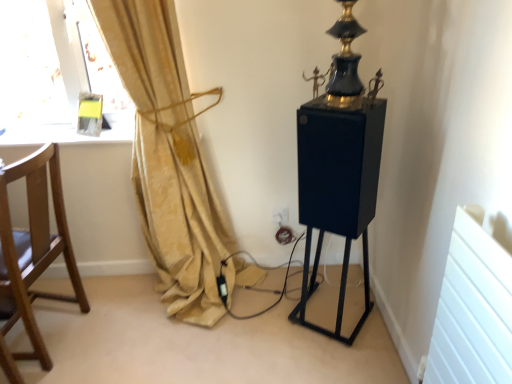
Question: Does gold fabric curtain at left turn towards matte glass window sill at upper left?

Choices:
 (A) no
 (B) yes

Answer: (A)

Question: From a real-world perspective, is gold fabric curtain at left located higher than matte glass window sill at upper left?

Choices:
 (A) yes
 (B) no

Answer: (B)

Question: Is gold fabric curtain at left looking in the opposite direction of matte glass window sill at upper left?

Choices:
 (A) yes
 (B) no

Answer: (A)

Question: Does gold fabric curtain at left appear on the left side of matte glass window sill at upper left?

Choices:
 (A) no
 (B) yes

Answer: (A)

Question: Is gold fabric curtain at left smaller than matte glass window sill at upper left?

Choices:
 (A) yes
 (B) no

Answer: (B)

Question: Is matte glass window sill at upper left taller or shorter than gold fabric curtain at left?

Choices:
 (A) short
 (B) tall

Answer: (A)

Question: Would you say matte glass window sill at upper left is to the left or to the right of gold fabric curtain at left in the picture?

Choices:
 (A) left
 (B) right

Answer: (A)

Question: From a real-world perspective, is matte glass window sill at upper left above or below gold fabric curtain at left?

Choices:
 (A) above
 (B) below

Answer: (A)

Question: Looking at their shapes, would you say matte glass window sill at upper left is wider or thinner than gold fabric curtain at left?

Choices:
 (A) thin
 (B) wide

Answer: (A)

Question: From a real-world perspective, relative to gold fabric curtain at left, is white plastic electric outlet at center vertically above or below?

Choices:
 (A) below
 (B) above

Answer: (A)

Question: Looking at the image, does white plastic electric outlet at center seem bigger or smaller compared to gold fabric curtain at left?

Choices:
 (A) big
 (B) small

Answer: (B)

Question: From the image's perspective, is white plastic electric outlet at center located above or below gold fabric curtain at left?

Choices:
 (A) above
 (B) below

Answer: (B)

Question: Is white plastic electric outlet at center taller or shorter than gold fabric curtain at left?

Choices:
 (A) tall
 (B) short

Answer: (B)

Question: From a real-world perspective, is wooden chair at left above or below white plastic electric outlet at center?

Choices:
 (A) below
 (B) above

Answer: (B)

Question: From the image's perspective, is wooden chair at left located above or below white plastic electric outlet at center?

Choices:
 (A) below
 (B) above

Answer: (A)